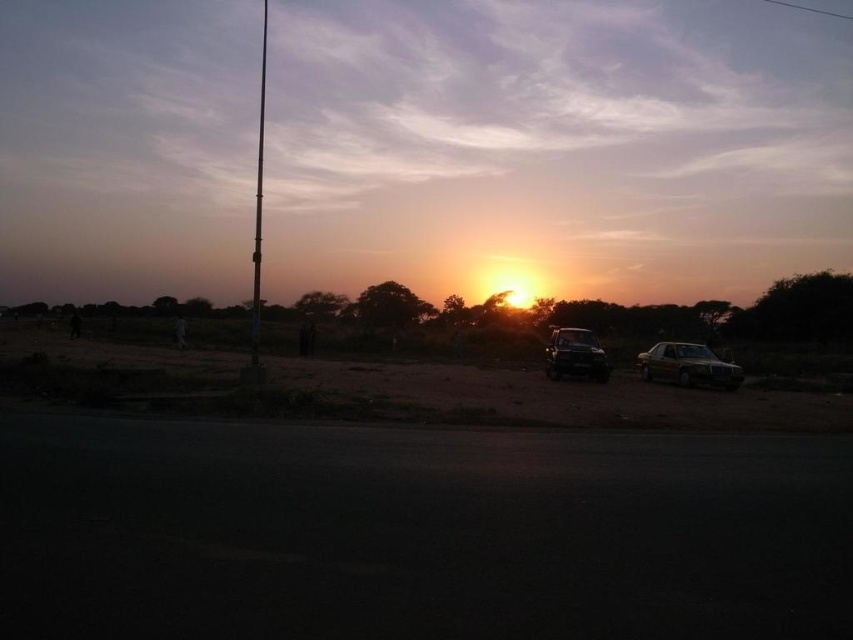
You are standing at the point with coordinates point (20, 356) and want to walk towards the point with coordinates point (595, 364). Given the scene described, will you have to walk uphill or downhill?

Since point (20, 356) is closer to the viewer than point (595, 364), you will have to walk uphill towards it because the latter is further away and likely at a higher elevation in the background.

You are a photographer setting up a camera on the road. You want to place a tripod between the metallic gold sedan at right and the metallic pole at left. Can the tripod fit between them if the tripod requires at least 1 meter of space?

The metallic gold sedan at right is thinner than the metallic pole at left. However, without specific measurements of their widths and the distance between them, it is impossible to determine if the tripod can fit. The provided information does not include the necessary spatial details like distance or exact widths to make this assessment.

You are standing at the point marked as point (383, 388) in the image. What type of terrain are you currently standing on?

The point (383, 388) is on a brown sandy dirt field at center, so you are standing on a brown sandy dirt field.